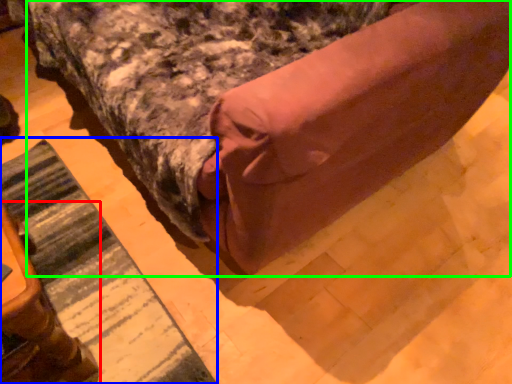
Question: Based on their relative distances, which object is farther from furniture (highlighted by a red box)? Choose from mat (highlighted by a blue box) and bed (highlighted by a green box).

Choices:
 (A) mat
 (B) bed

Answer: (B)